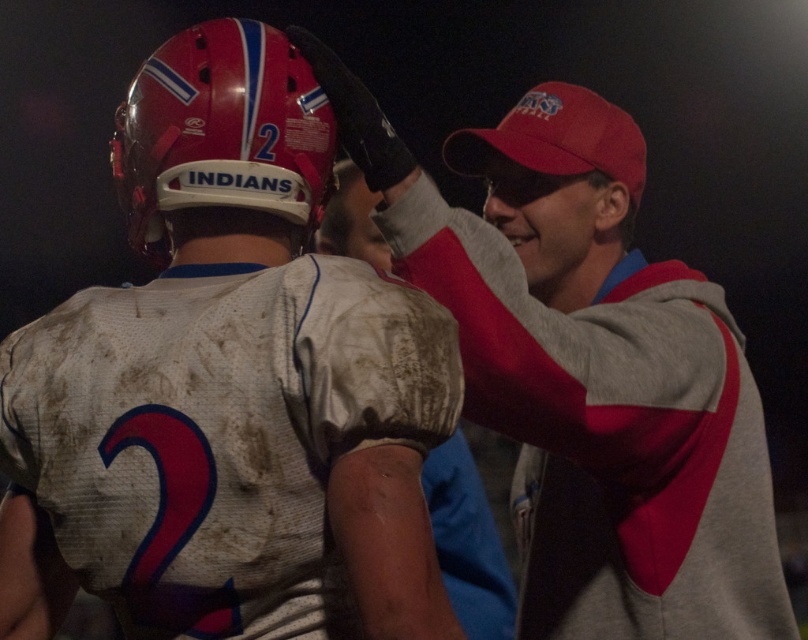
Please describe the color and pattern of the clothing item located at point coordinates (x=228, y=387) in the image.

The point at coordinates (x=228, y=387) is on a matte white jersey at center, which has the number 2 in red and blue and the word INDIANS across the helmet.